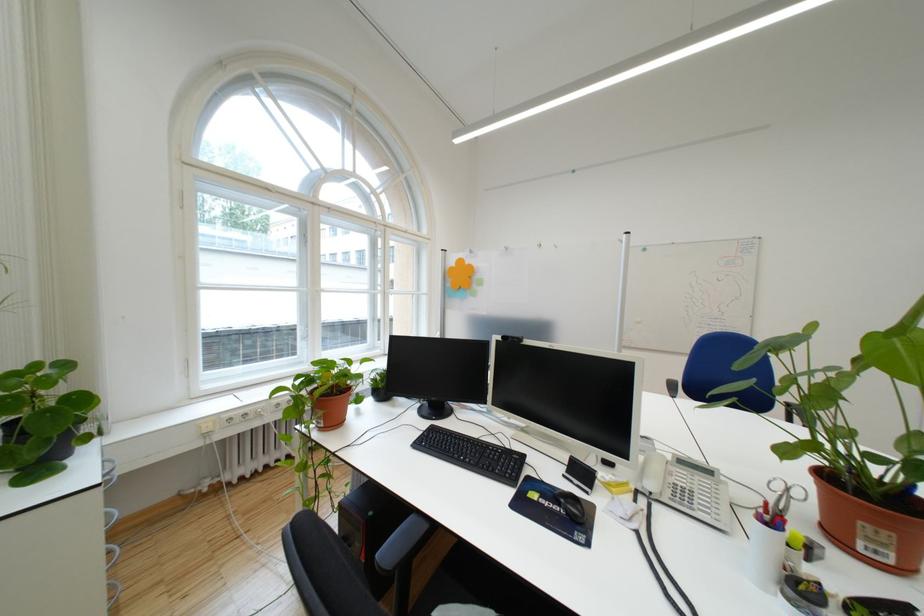
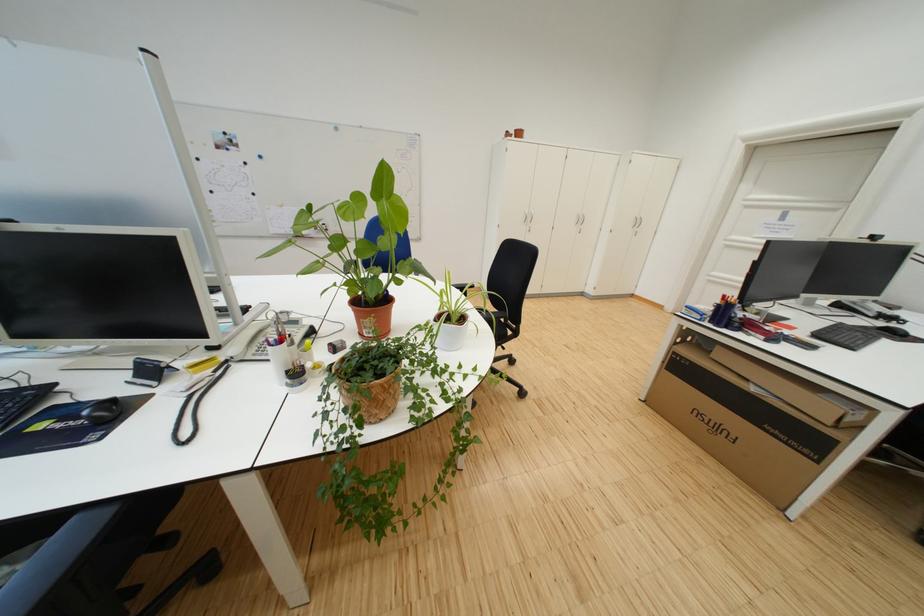
In the second image, find the point that corresponds to point (578, 512) in the first image.

(103, 419)